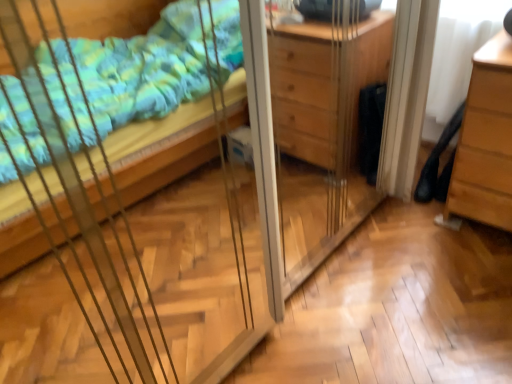
Describe the element at coordinates (486, 140) in the screenshot. I see `light brown wood chest of drawers at right` at that location.

Where is `light brown wood chest of drawers at right`? The height and width of the screenshot is (384, 512). light brown wood chest of drawers at right is located at coordinates (486, 140).

This screenshot has width=512, height=384. In order to click on light brown wood chest of drawers at right in this screenshot , I will do `click(486, 140)`.